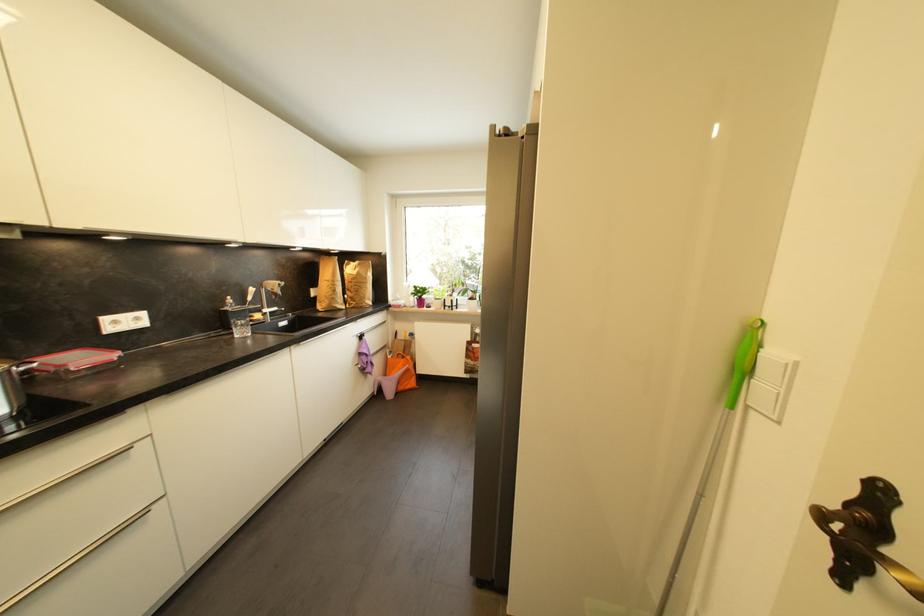
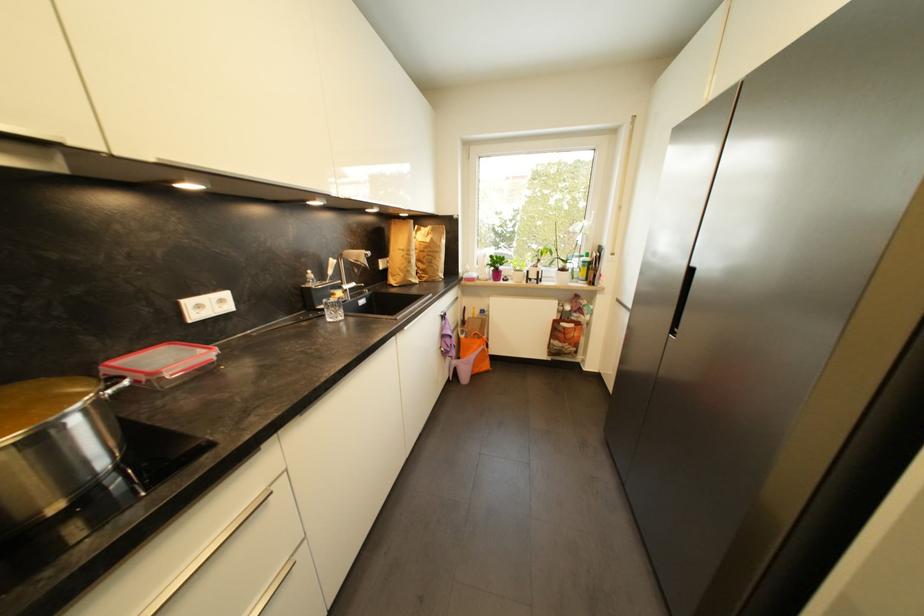
In the second image, find the point that corresponds to point (419, 289) in the first image.

(495, 257)